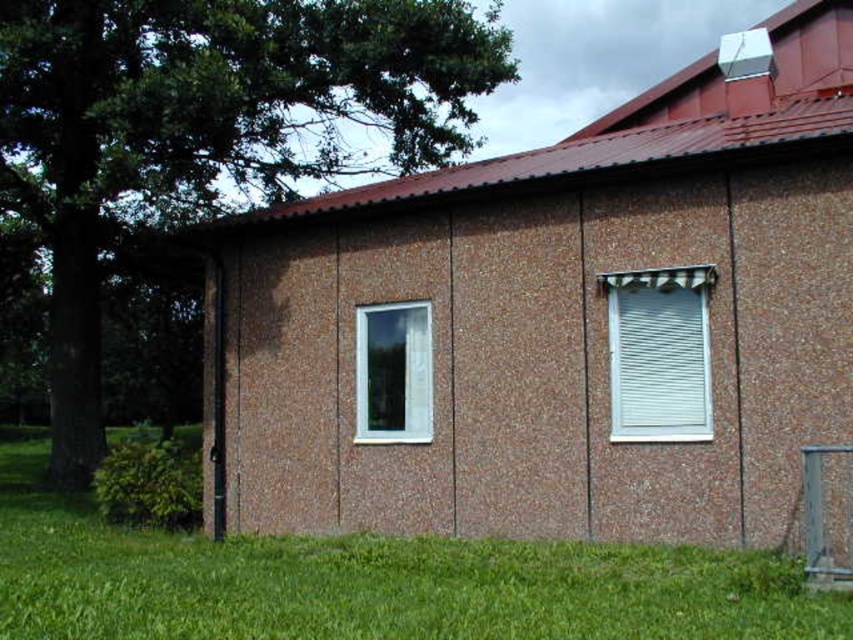
Question: Which of these objects is positioned farthest from the clear glass window at center?

Choices:
 (A) green leafy tree at left
 (B) brown textured wall at center
 (C) green grass at lower center

Answer: (A)

Question: Estimate the real-world distances between objects in this image. Which object is closer to the clear glass window at center?

Choices:
 (A) brown textured wall at center
 (B) white textured blinds at right
 (C) green grass at lower center
 (D) green leafy tree at left

Answer: (A)

Question: Which of these objects is positioned closest to the green leafy tree at left?

Choices:
 (A) white textured blinds at right
 (B) clear glass window at center

Answer: (B)

Question: Does green leafy tree at left have a greater width compared to clear glass window at center?

Choices:
 (A) no
 (B) yes

Answer: (B)

Question: Does brown textured wall at center have a greater width compared to green leafy tree at left?

Choices:
 (A) no
 (B) yes

Answer: (A)

Question: Is brown textured wall at center further to the viewer compared to green leafy tree at left?

Choices:
 (A) yes
 (B) no

Answer: (B)